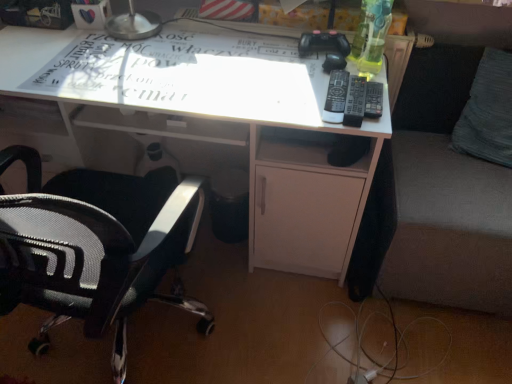
The width and height of the screenshot is (512, 384). I want to click on blank space situated above white glossy desk at center (from a real-world perspective), so click(133, 57).